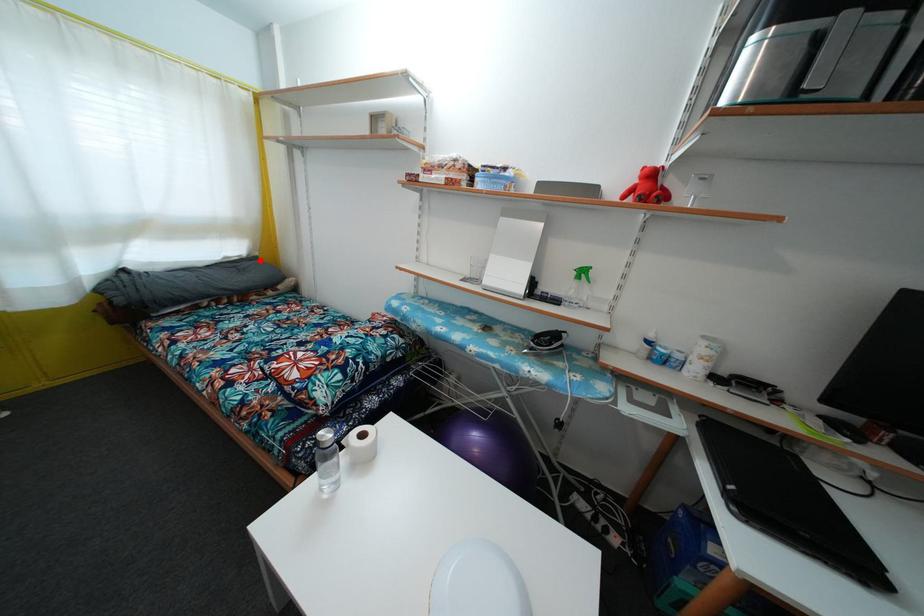
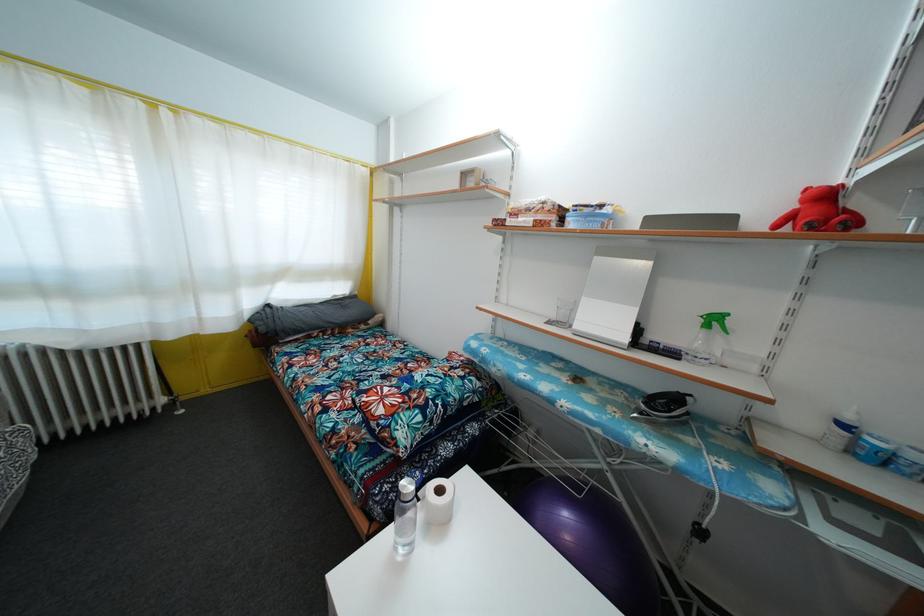
Where in the second image is the point corresponding to the highlighted location from the first image?

(359, 300)